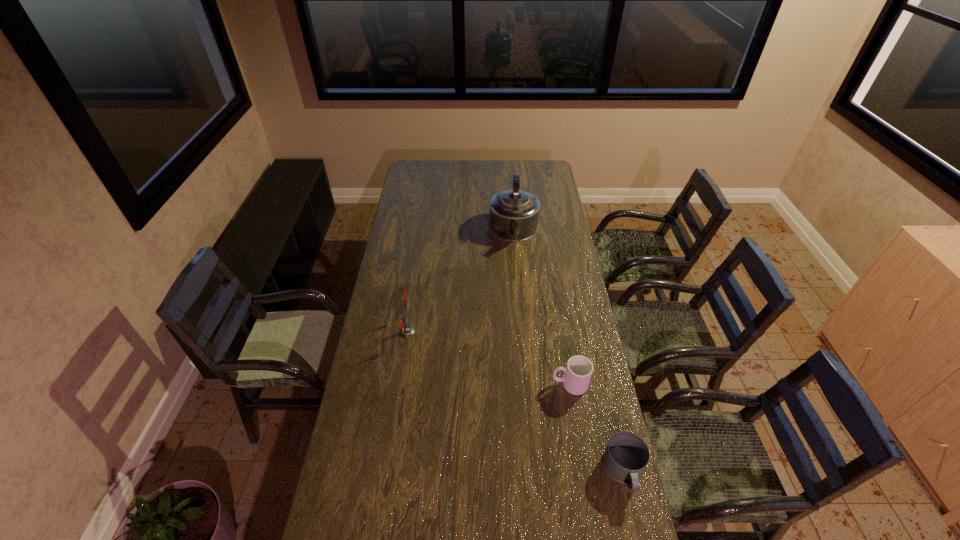
This screenshot has width=960, height=540. I want to click on free region at the near edge of the desktop, so click(x=512, y=502).

In the image, there is a desktop. Identify the location of vacant space at the left edge. This screenshot has height=540, width=960. (402, 251).

At what (x,y) coordinates should I click in order to perform the action: click on vacant space at the right edge. Please return your answer as a coordinate pair (x, y). Image resolution: width=960 pixels, height=540 pixels. Looking at the image, I should click on 554,231.

Image resolution: width=960 pixels, height=540 pixels. In the image, there is a desktop. Identify the location of free space at the far left corner. 427,165.

The width and height of the screenshot is (960, 540). I want to click on free spot between the kettle and the candle, so click(x=460, y=281).

Find the location of a particular element. The width and height of the screenshot is (960, 540). free spot between the mug and the leftmost object is located at coordinates (516, 401).

The image size is (960, 540). In order to click on free space between the second shortest object and the third shortest object in this screenshot , I will do `click(488, 358)`.

You are a GUI agent. You are given a task and a screenshot of the screen. Output one action in this format:
    pyautogui.click(x=<x>, y=<y>)
    Task: Click on the empty space between the second nearest object and the farthest object
    Image resolution: width=960 pixels, height=540 pixels.
    Given the screenshot: What is the action you would take?
    pyautogui.click(x=541, y=308)

I want to click on vacant area that lies between the kettle and the second shortest object, so [x=541, y=308].

The image size is (960, 540). In order to click on empty location between the tallest object and the mug in this screenshot , I will do `click(568, 351)`.